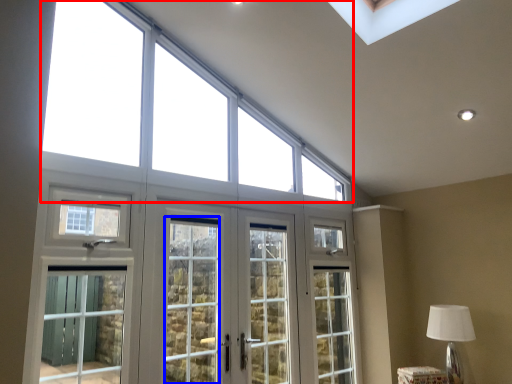
Question: Which of the following is the farthest to the observer, window (highlighted by a red box) or screen door (highlighted by a blue box)?

Choices:
 (A) window
 (B) screen door

Answer: (B)